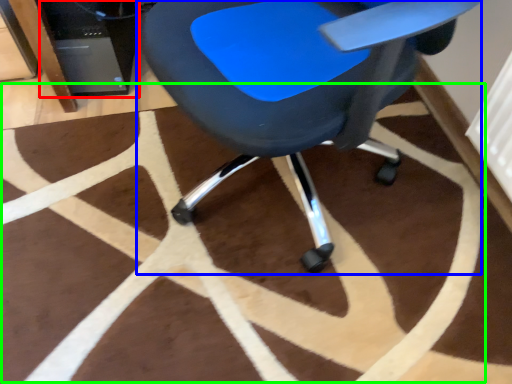
Question: Based on their relative distances, which object is farther from computer tower (highlighted by a red box)? Choose from chair (highlighted by a blue box) and mat (highlighted by a green box).

Choices:
 (A) chair
 (B) mat

Answer: (A)